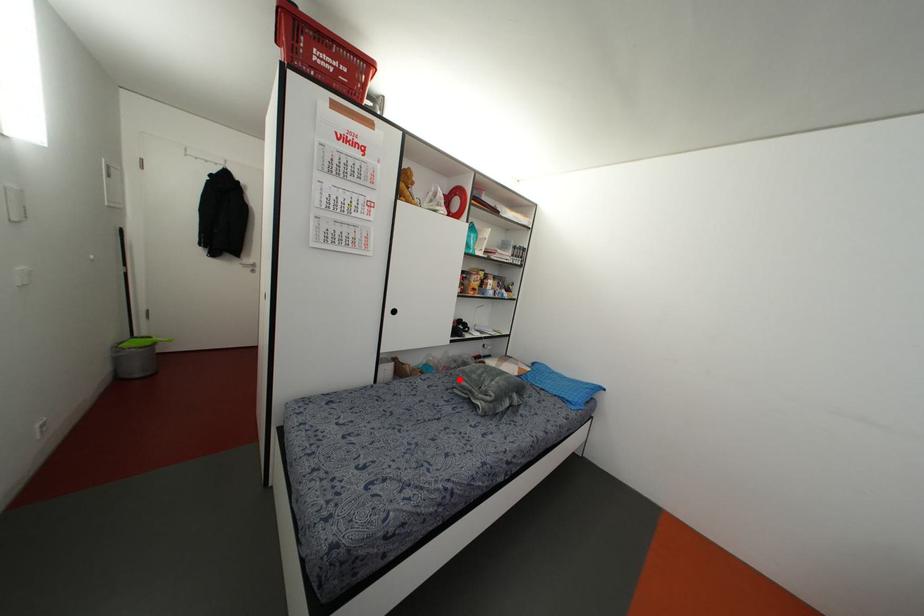
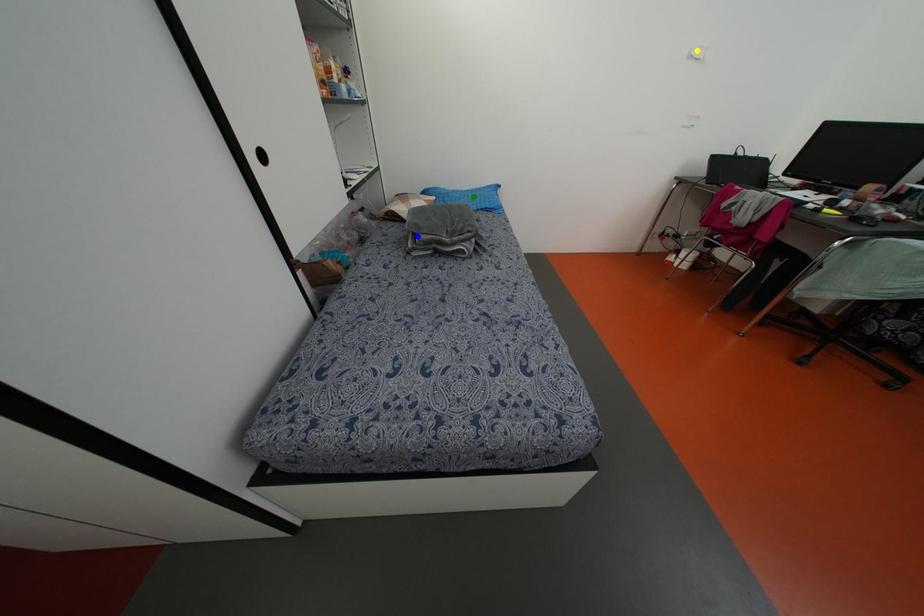
Question: I am providing you with two images of the same scene from different viewpoints. A red point is marked on the first image. You are given multiple points on the second image. Which mark in image 2 goes with the point in image 1?

Choices:
 (A) green point
 (B) yellow point
 (C) blue point

Answer: (C)